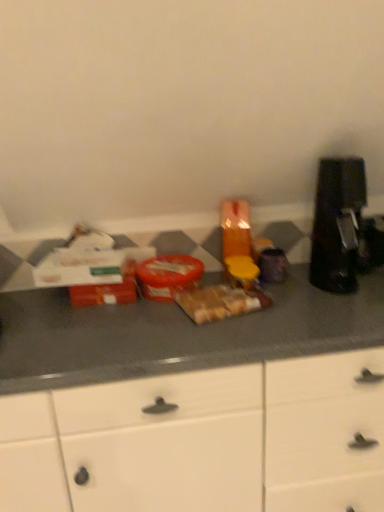
Question: Considering the positions of brown matte sandwich at center, positioned as the 1th food in right-to-left order, and white matte cabinet at center in the image, is brown matte sandwich at center, positioned as the 1th food in right-to-left order, taller or shorter than white matte cabinet at center?

Choices:
 (A) tall
 (B) short

Answer: (B)

Question: Is point (183, 293) positioned closer to the camera than point (193, 394)?

Choices:
 (A) closer
 (B) farther

Answer: (B)

Question: Based on their relative distances, which object is farther from the black plastic coffee machine at right?

Choices:
 (A) white matte cabinet at center
 (B) brown matte sandwich at center, marked as the second food in a left-to-right arrangement
 (C) matte plastic container at center, marked as the second food in a right-to-left arrangement

Answer: (A)

Question: Considering the real-world distances, which object is farthest from the white matte cabinet at center?

Choices:
 (A) matte plastic container at center, marked as the second food in a right-to-left arrangement
 (B) black plastic coffee machine at right
 (C) brown matte sandwich at center, positioned as the 1th food in right-to-left order

Answer: (B)